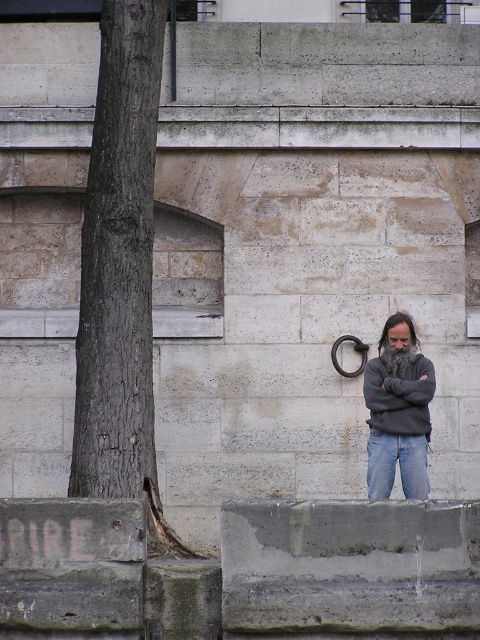
You are a painter standing in front of the scene. You need to paint the brown rough bark tree at left and denim jeans at lower center. Which object should you paint first if you want to follow the rule of starting with the taller object?

The brown rough bark tree at left is taller than the denim jeans at lower center, so you should paint the brown rough bark tree at left first.

In the scene shown: You are a delivery person who needs to deliver a package to the denim jeans at lower center. There is a brown rough bark tree at left blocking your path. Can you walk around the tree to reach the destination?

The brown rough bark tree at left is to the left of denim jeans at lower center, so you can walk around the tree to the right side to reach the denim jeans at lower center.